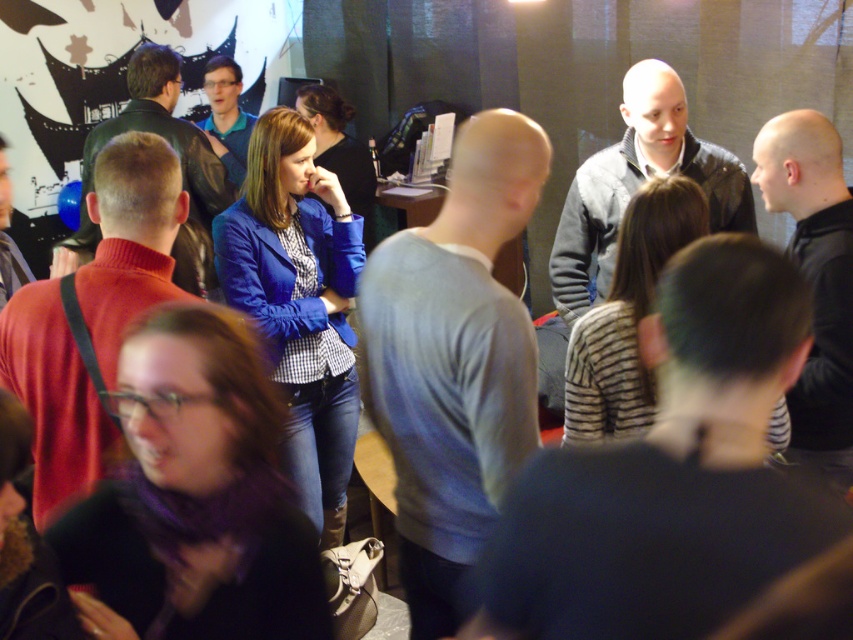
Question: From the image, what is the correct spatial relationship of black leather jacket at right in relation to matte black jacket at upper left?

Choices:
 (A) below
 (B) above

Answer: (A)

Question: Among these objects, which one is farthest from the camera?

Choices:
 (A) matte blue shirt at center
 (B) black leather jacket at right
 (C) gray matte jacket at center

Answer: (A)

Question: Which of the following is the closest to the observer?

Choices:
 (A) (119, 113)
 (B) (525, 582)
 (C) (775, 160)
 (D) (228, 134)

Answer: (B)

Question: Is gray cotton sweater at center bigger than red sweater at left?

Choices:
 (A) no
 (B) yes

Answer: (B)

Question: Estimate the real-world distances between objects in this image. Which object is closer to the black leather jacket at right?

Choices:
 (A) gray cotton sweater at center
 (B) matte blue shirt at center
 (C) dark gray sweater at center
 (D) matte black jacket at upper left

Answer: (A)

Question: Is gray cotton sweater at center positioned at the back of matte black jacket at upper left?

Choices:
 (A) no
 (B) yes

Answer: (A)